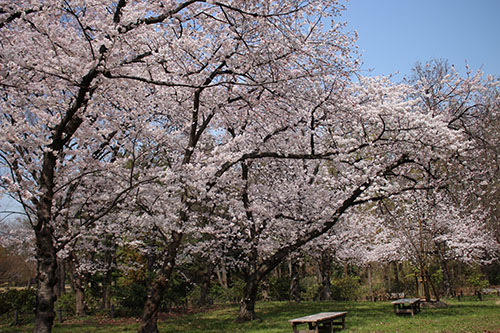
Where is `bench tables`? bench tables is located at coordinates (326, 317), (408, 304).